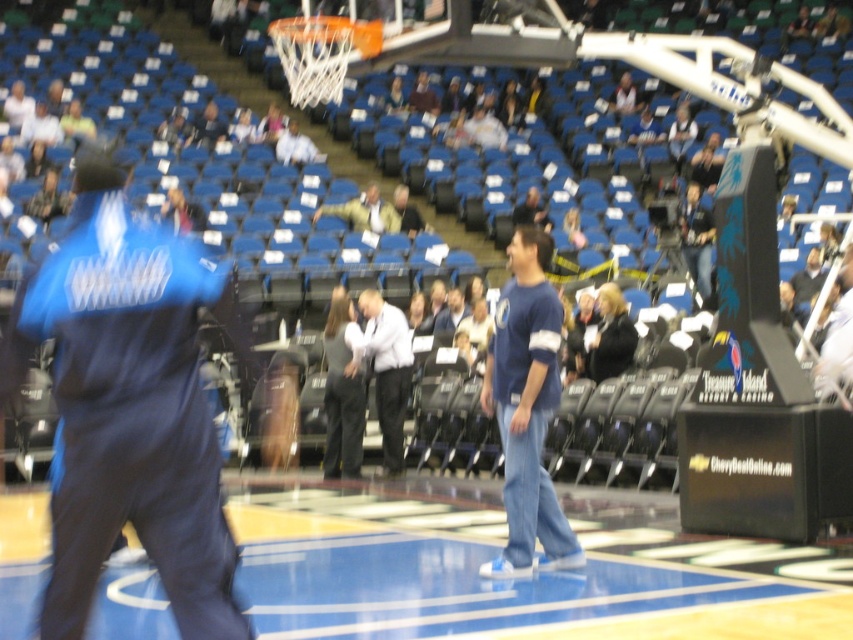
Does blue glossy court at center have a greater height compared to blue fabric mascot at left?

No.

Is blue glossy court at center in front of blue fabric mascot at left?

No.

Which is behind, point (41, 524) or point (219, 515)?

Point (41, 524)

I want to click on blue glossy court at center, so click(x=515, y=582).

Can you confirm if white shirt at center is positioned to the left of light brown leather jacket at center?

No, white shirt at center is not to the left of light brown leather jacket at center.

Is white shirt at center further to the viewer compared to light brown leather jacket at center?

No, white shirt at center is closer to the viewer.

Who is more distant from viewer, (x=375, y=304) or (x=357, y=225)?

Point (x=357, y=225)

I want to click on white shirt at center, so click(387, 371).

Is blue glossy court at center further to the viewer compared to light brown leather jacket at center?

No, blue glossy court at center is in front of light brown leather jacket at center.

The width and height of the screenshot is (853, 640). What are the coordinates of `blue glossy court at center` in the screenshot? It's located at (515, 582).